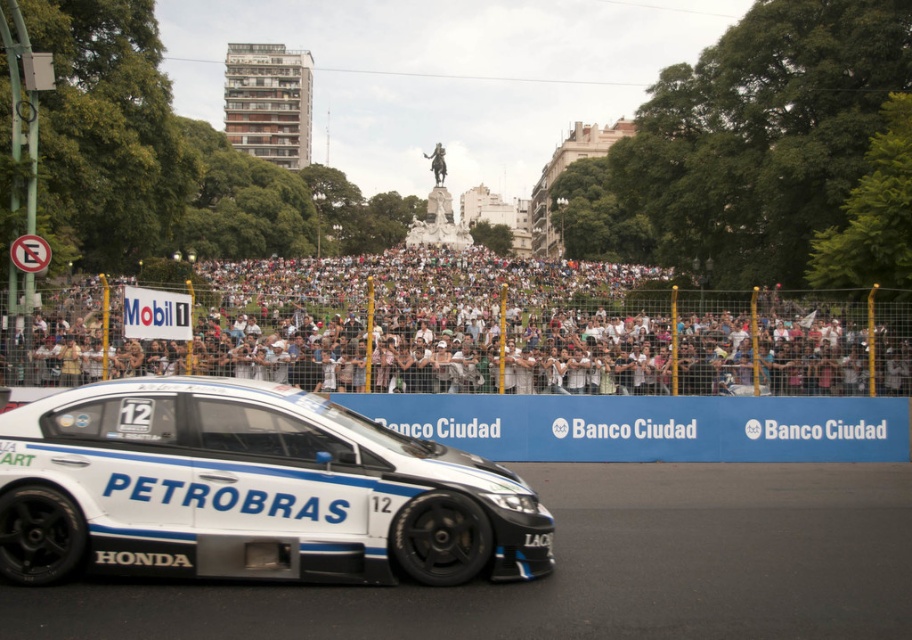
You are a drone operator trying to capture aerial footage of the white smooth asphalt at center and the white glossy car at center. Based on their heights, which one will appear larger in your camera view?

The white glossy car at center appears larger in the camera view because it has a greater height than the white smooth asphalt at center.

You are a race car driver preparing for the start of the race. You notice the white smooth asphalt at center and the white glossy car at center. Which object is closer to you as you sit in the driver seat?

The white smooth asphalt at center is closer to you because it is in front of the white glossy car at center, meaning the asphalt is positioned nearer to your viewpoint in the driver seat.

You are a photographer standing in front of the white glossy car at center. You want to take a photo of the white crowd at upper center without the car blocking the view. Is it possible?

The white crowd at upper center is further to the viewer than the white glossy car at center, so the car will not block the view. You can take the photo without any obstruction.